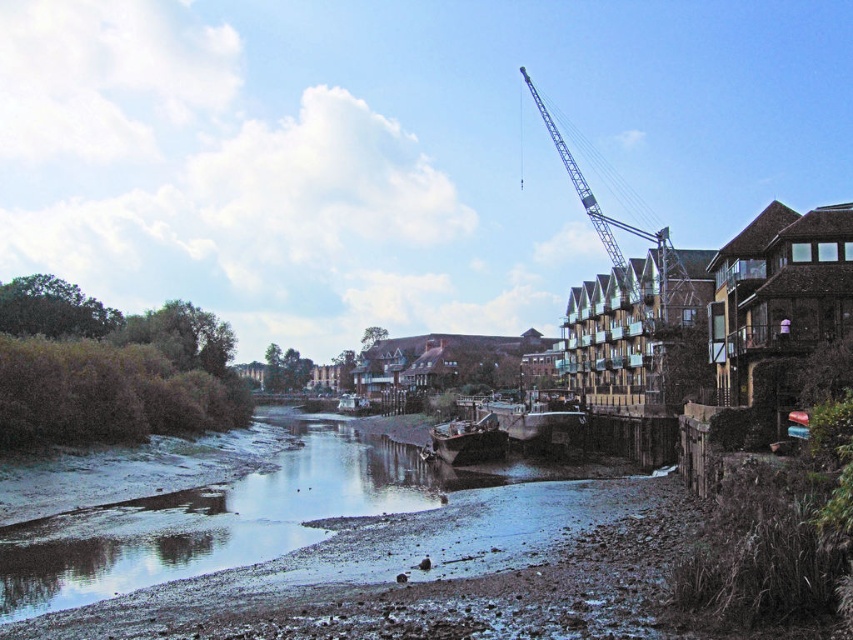
Can you confirm if smooth mud at lower center is thinner than metallic gray crane at upper right?

Indeed, smooth mud at lower center has a lesser width compared to metallic gray crane at upper right.

What are the coordinates of `smooth mud at lower center` in the screenshot? It's located at (289, 516).

Is point (473, 518) less distant than point (692, 300)?

That is True.

The image size is (853, 640). I want to click on smooth mud at lower center, so click(x=289, y=516).